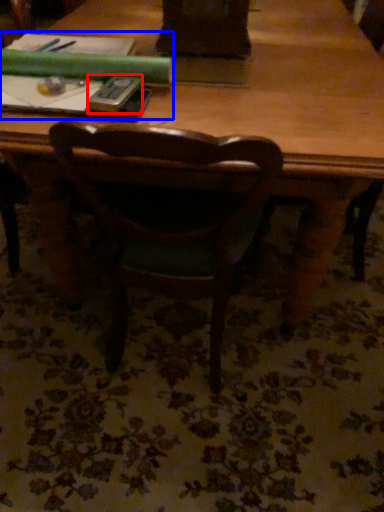
Question: Which object appears farthest to the camera in this image, paperback book (highlighted by a red box) or book (highlighted by a blue box)?

Choices:
 (A) paperback book
 (B) book

Answer: (B)